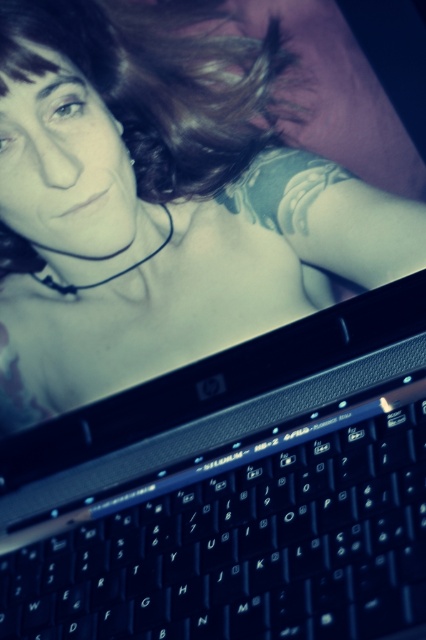
You are a delivery person who needs to place a small package on the nearest surface. You see the matte black laptop at lower center. Is the surface where the laptop is placed large enough to hold the package?

The matte black laptop at lower center is 62.38 centimeters from viewer, so the surface where the laptop is placed is likely large enough to hold the package since it can accommodate the laptop and still have space remaining.

You are a delivery robot in a home. You need to place a small package on the surface near the black plastic keyboard at bottom without blocking the camera. Can you fit the package between them if it requires 41 centimeters of space?

The black plastic keyboard at bottom and camera are 40.99 centimeters apart from each other, so the package requiring 41 centimeters cannot fit between them.

You are a delivery person who just delivered a laptop and a keyboard. You need to place them on a table that is 10 inches wide. Can you fit both the matte black laptop at lower center and the black plastic keyboard at bottom side by side on the table without overlapping?

The distance between the matte black laptop at lower center and the black plastic keyboard at bottom is 9.12 inches, so yes, they can be placed side by side on a 10 inch wide table since the total width required is less than the table width.